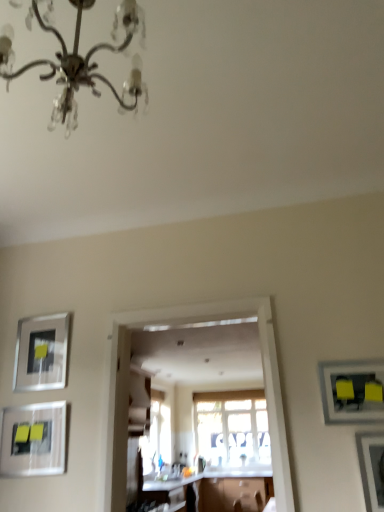
What do you see at coordinates (352, 391) in the screenshot?
I see `matte black picture frame at right, the second picture frame in the front-to-back sequence` at bounding box center [352, 391].

Measure the distance between silver metallic picture frame at left, the first picture frame positioned from the left, and camera.

7.93 feet.

What do you see at coordinates (41, 353) in the screenshot?
I see `silver metallic picture frame at left, the 1th picture frame viewed from the back` at bounding box center [41, 353].

Locate an element on the screen. The width and height of the screenshot is (384, 512). transparent glass door at center is located at coordinates (179, 327).

The height and width of the screenshot is (512, 384). Identify the location of matte silver picture frame at lower left, the 2th picture frame when ordered from left to right. (33, 440).

This screenshot has height=512, width=384. What do you see at coordinates (372, 468) in the screenshot?
I see `metallic silver picture frame at lower right, placed as the 1th picture frame when sorted from right to left` at bounding box center [372, 468].

You are a GUI agent. You are given a task and a screenshot of the screen. Output one action in this format:
    pyautogui.click(x=<x>, y=<y>)
    Task: Click on the matte black picture frame at right, which is the third picture frame in back-to-front order
    The height and width of the screenshot is (512, 384).
    Given the screenshot: What is the action you would take?
    pyautogui.click(x=352, y=391)

Considering the relative sizes of matte silver picture frame at lower left, the 2th picture frame when ordered from left to right, and transparent glass door at center in the image provided, is matte silver picture frame at lower left, the 2th picture frame when ordered from left to right, shorter than transparent glass door at center?

Yes.

Which picture frame is the 1st one when counting from the left side of the transparent glass door at center? Please provide its 2D coordinates.

[(33, 440)]

From the picture: From a real-world perspective, is matte silver picture frame at lower left, the 2th picture frame when ordered from left to right, under transparent glass door at center?

Yes, from a real-world perspective, matte silver picture frame at lower left, the 2th picture frame when ordered from left to right, is under transparent glass door at center.

Considering the sizes of objects matte silver picture frame at lower left, the third picture frame from the right, and transparent glass door at center in the image provided, who is wider, matte silver picture frame at lower left, the third picture frame from the right, or transparent glass door at center?

Wider between the two is transparent glass door at center.

Is white glossy table at center positioned far away from matte silver picture frame at lower left, the third picture frame from the right?

Yes, white glossy table at center and matte silver picture frame at lower left, the third picture frame from the right, are located far from each other.

How far apart are white glossy table at center and matte silver picture frame at lower left, the 2th picture frame when ordered from left to right?

white glossy table at center is 4.16 meters away from matte silver picture frame at lower left, the 2th picture frame when ordered from left to right.

From the picture: From a real-world perspective, is white glossy table at center physically located above or below matte silver picture frame at lower left, which appears as the 3th picture frame when viewed from the front?

From a real-world perspective, white glossy table at center is physically below matte silver picture frame at lower left, which appears as the 3th picture frame when viewed from the front.

Considering the relative sizes of white glossy table at center and matte silver picture frame at lower left, the 2th picture frame when ordered from left to right, in the image provided, is white glossy table at center wider than matte silver picture frame at lower left, the 2th picture frame when ordered from left to right,?

Yes.

From a real-world perspective, which object stands above the other?

translucent glass window at center is physically above.

From the picture: Who is bigger, white glossy countertop at center or translucent glass window at center?

translucent glass window at center.

Consider the image. Which is in front, white glossy countertop at center or translucent glass window at center?

white glossy countertop at center is more forward.

Does white glossy countertop at center appear on the left side of translucent glass window at center?

Yes, white glossy countertop at center is to the left of translucent glass window at center.

Who is bigger, silver metallic picture frame at left, arranged as the fourth picture frame when viewed from the front, or matte silver picture frame at lower left, which appears as the 3th picture frame when viewed from the front?

matte silver picture frame at lower left, which appears as the 3th picture frame when viewed from the front, is bigger.

From a real-world perspective, is silver metallic picture frame at left, the first picture frame positioned from the left, positioned under matte silver picture frame at lower left, the third picture frame from the right, based on gravity?

Actually, silver metallic picture frame at left, the first picture frame positioned from the left, is physically above matte silver picture frame at lower left, the third picture frame from the right, in the real world.

Can you confirm if silver metallic picture frame at left, the first picture frame positioned from the left, is positioned to the right of matte silver picture frame at lower left, which is counted as the second picture frame, starting from the back?

Incorrect, silver metallic picture frame at left, the first picture frame positioned from the left, is not on the right side of matte silver picture frame at lower left, which is counted as the second picture frame, starting from the back.

Is silver metallic picture frame at left, arranged as the fourth picture frame when viewed from the front, positioned with its back to matte silver picture frame at lower left, the 2th picture frame when ordered from left to right?

No, silver metallic picture frame at left, arranged as the fourth picture frame when viewed from the front, is not facing the opposite direction of matte silver picture frame at lower left, the 2th picture frame when ordered from left to right.

Considering the relative positions of metallic silver picture frame at lower right, which is counted as the 4th picture frame, starting from the back, and matte black picture frame at right, the second picture frame in the front-to-back sequence, in the image provided, is metallic silver picture frame at lower right, which is counted as the 4th picture frame, starting from the back, in front of matte black picture frame at right, the second picture frame in the front-to-back sequence,?

Yes, metallic silver picture frame at lower right, which is counted as the 4th picture frame, starting from the back, is closer to the viewer.

Can you tell me how much metallic silver picture frame at lower right, which ranks as the 4th picture frame in left-to-right order, and matte black picture frame at right, marked as the third picture frame in a left-to-right arrangement, differ in facing direction?

0.00534 degrees.

Which of these two, metallic silver picture frame at lower right, which is counted as the 4th picture frame, starting from the back, or matte black picture frame at right, which appears as the 2th picture frame when viewed from the right, is wider?

With larger width is metallic silver picture frame at lower right, which is counted as the 4th picture frame, starting from the back.

Considering the sizes of objects metallic silver picture frame at lower right, acting as the first picture frame starting from the front, and matte black picture frame at right, which is the third picture frame in back-to-front order, in the image provided, who is bigger, metallic silver picture frame at lower right, acting as the first picture frame starting from the front, or matte black picture frame at right, which is the third picture frame in back-to-front order,?

With larger size is metallic silver picture frame at lower right, acting as the first picture frame starting from the front.

At what (x,y) coordinates should I click in order to perform the action: click on window above the white glossy table at center (from the image's perspective). Please return your answer as a coordinate pair (x, y). Image resolution: width=384 pixels, height=512 pixels. Looking at the image, I should click on (232, 426).

From a real-world perspective, is white glossy table at center physically located above or below translucent glass window at center?

white glossy table at center is below translucent glass window at center.

From the image's perspective, would you say white glossy table at center is shown under translucent glass window at center?

Correct, white glossy table at center appears lower than translucent glass window at center in the image.

Is transparent glass door at center looking in the opposite direction of white glossy table at center?

Yes, transparent glass door at center's orientation is away from white glossy table at center.

You are a GUI agent. You are given a task and a screenshot of the screen. Output one action in this format:
    pyautogui.click(x=<x>, y=<y>)
    Task: Click on the table behind the transparent glass door at center
    The height and width of the screenshot is (512, 384).
    Given the screenshot: What is the action you would take?
    coord(219,488)

Between transparent glass door at center and white glossy table at center, which one has less height?

With less height is white glossy table at center.

Does point (240, 303) appear closer or farther from the camera than point (156, 487)?

Point (240, 303) is closer to the camera than point (156, 487).

In order to click on the 2nd picture frame behind the transparent glass door at center in this screenshot , I will do `click(33, 440)`.

Locate an element on the screen. Image resolution: width=384 pixels, height=512 pixels. the 1st picture frame to the left of the white glossy table at center, starting your count from the anchor is located at coordinates (33, 440).

Estimate the real-world distances between objects in this image. Which object is closer to metallic silver picture frame at lower right, placed as the 1th picture frame when sorted from right to left, silver metallic chandelier at upper center or matte silver picture frame at lower left, the 2th picture frame when ordered from left to right?

matte silver picture frame at lower left, the 2th picture frame when ordered from left to right.

From the image, which object appears to be nearer to silver metallic picture frame at left, arranged as the fourth picture frame when viewed from the front, transparent glass door at center or translucent glass window at center?

Based on the image, transparent glass door at center appears to be nearer to silver metallic picture frame at left, arranged as the fourth picture frame when viewed from the front.

From the image, which object appears to be nearer to translucent glass window at center, white glossy table at center or silver metallic chandelier at upper center?

white glossy table at center.

Which object lies further to the anchor point translucent glass window at center, metallic silver picture frame at lower right, which is counted as the 4th picture frame, starting from the back, or white glossy table at center?

Based on the image, metallic silver picture frame at lower right, which is counted as the 4th picture frame, starting from the back, appears to be further to translucent glass window at center.

Considering their positions, is silver metallic chandelier at upper center positioned further to white glossy countertop at center than translucent glass window at center?

silver metallic chandelier at upper center lies further to white glossy countertop at center than the other object.

From the image, which object appears to be nearer to white glossy table at center, white glossy countertop at center or silver metallic picture frame at left, the 1th picture frame viewed from the back?

Among the two, white glossy countertop at center is located nearer to white glossy table at center.

Looking at the image, which one is located closer to silver metallic picture frame at left, the first picture frame positioned from the left, metallic silver picture frame at lower right, acting as the first picture frame starting from the front, or matte silver picture frame at lower left, the third picture frame from the right?

Among the two, matte silver picture frame at lower left, the third picture frame from the right, is located nearer to silver metallic picture frame at left, the first picture frame positioned from the left.

When comparing their distances from silver metallic chandelier at upper center, does transparent glass door at center or white glossy countertop at center seem further?

white glossy countertop at center lies further to silver metallic chandelier at upper center than the other object.

Locate an element on the screen. chandelier located between silver metallic picture frame at left, arranged as the fourth picture frame when viewed from the front, and matte black picture frame at right, which is the third picture frame in back-to-front order, in the left-right direction is located at coordinates (81, 61).

Where is `table between metallic silver picture frame at lower right, placed as the 1th picture frame when sorted from right to left, and translucent glass window at center from front to back`? This screenshot has height=512, width=384. table between metallic silver picture frame at lower right, placed as the 1th picture frame when sorted from right to left, and translucent glass window at center from front to back is located at coordinates (219, 488).

Where is `glass door between silver metallic chandelier at upper center and matte silver picture frame at lower left, the third picture frame from the right, from top to bottom`? The height and width of the screenshot is (512, 384). glass door between silver metallic chandelier at upper center and matte silver picture frame at lower left, the third picture frame from the right, from top to bottom is located at coordinates (179, 327).

Find the location of a particular element. picture frame situated between silver metallic picture frame at left, the 1th picture frame viewed from the back, and transparent glass door at center from left to right is located at coordinates (33, 440).